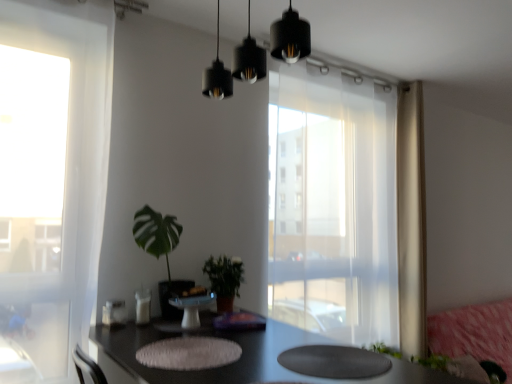
Question: Does black matte pendant lights at upper center appear on the right side of transparent curtain at center?

Choices:
 (A) yes
 (B) no

Answer: (B)

Question: Is black matte pendant lights at upper center wider than transparent curtain at center?

Choices:
 (A) no
 (B) yes

Answer: (B)

Question: Is black matte pendant lights at upper center located outside transparent curtain at center?

Choices:
 (A) no
 (B) yes

Answer: (B)

Question: Can you confirm if black matte pendant lights at upper center is taller than transparent curtain at center?

Choices:
 (A) no
 (B) yes

Answer: (A)

Question: Can transparent curtain at center be found inside black matte pendant lights at upper center?

Choices:
 (A) no
 (B) yes

Answer: (A)

Question: From a real-world perspective, is black matte pendant lights at upper center physically below transparent curtain at center?

Choices:
 (A) yes
 (B) no

Answer: (B)

Question: From the image's perspective, would you say white glossy cake stand at center is positioned over pink fabric couch at lower right?

Choices:
 (A) yes
 (B) no

Answer: (A)

Question: Considering the relative sizes of white glossy cake stand at center and pink fabric couch at lower right in the image provided, is white glossy cake stand at center thinner than pink fabric couch at lower right?

Choices:
 (A) no
 (B) yes

Answer: (B)

Question: Is white glossy cake stand at center in contact with pink fabric couch at lower right?

Choices:
 (A) no
 (B) yes

Answer: (A)

Question: Does white glossy cake stand at center have a greater width compared to pink fabric couch at lower right?

Choices:
 (A) no
 (B) yes

Answer: (A)

Question: Can you confirm if white glossy cake stand at center is bigger than pink fabric couch at lower right?

Choices:
 (A) no
 (B) yes

Answer: (A)

Question: Considering the relative sizes of white glossy cake stand at center and pink fabric couch at lower right in the image provided, is white glossy cake stand at center taller than pink fabric couch at lower right?

Choices:
 (A) no
 (B) yes

Answer: (A)

Question: Would you say beige sheer curtain at right is part of transparent curtain at center's contents?

Choices:
 (A) yes
 (B) no

Answer: (B)